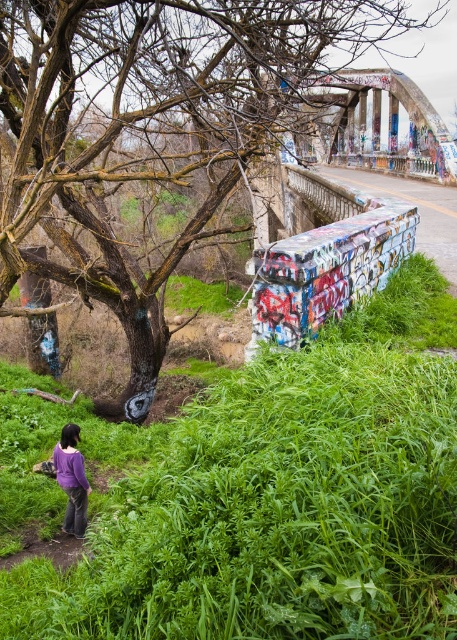
Measure the distance between green leafy grass at lower center and brown bark tree at upper left.

They are 8.76 meters apart.

Does green leafy grass at lower center have a larger size compared to brown bark tree at upper left?

Incorrect, green leafy grass at lower center is not larger than brown bark tree at upper left.

Is point (308, 502) in front of point (110, 77)?

Yes, it is.

The width and height of the screenshot is (457, 640). What are the coordinates of `green leafy grass at lower center` in the screenshot? It's located at (281, 499).

Does point (330, 362) lie in front of point (74, 506)?

Yes.

Can you confirm if green leafy grass at lower center is positioned to the right of purple matte shirt at lower left?

Correct, you'll find green leafy grass at lower center to the right of purple matte shirt at lower left.

Is point (180, 518) positioned behind point (65, 458)?

No, it is in front of (65, 458).

At what (x,y) coordinates should I click in order to perform the action: click on green leafy grass at lower center. Please return your answer as a coordinate pair (x, y). Looking at the image, I should click on (281, 499).

This screenshot has width=457, height=640. What do you see at coordinates (149, 129) in the screenshot?
I see `brown bark tree at upper left` at bounding box center [149, 129].

The height and width of the screenshot is (640, 457). Find the location of `brown bark tree at upper left`. brown bark tree at upper left is located at coordinates (149, 129).

You are a GUI agent. You are given a task and a screenshot of the screen. Output one action in this format:
    pyautogui.click(x=<x>, y=<y>)
    Task: Click on the brown bark tree at upper left
    This screenshot has width=457, height=640.
    Given the screenshot: What is the action you would take?
    pyautogui.click(x=149, y=129)